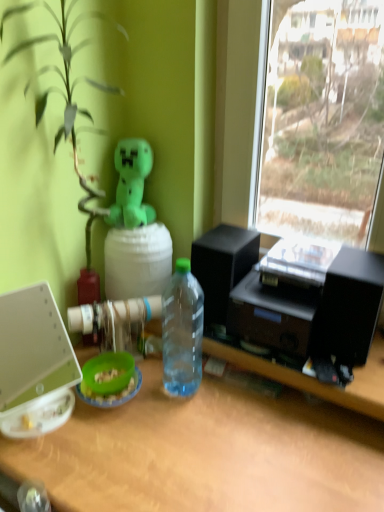
Question: Is transparent plastic bottle at center not near white plastic laptop at left?

Choices:
 (A) yes
 (B) no

Answer: (B)

Question: From a real-world perspective, is transparent plastic bottle at center on white plastic laptop at left?

Choices:
 (A) no
 (B) yes

Answer: (B)

Question: Is transparent plastic bottle at center positioned behind white plastic laptop at left?

Choices:
 (A) no
 (B) yes

Answer: (B)

Question: Is transparent plastic bottle at center at the left side of white plastic laptop at left?

Choices:
 (A) yes
 (B) no

Answer: (B)

Question: Is transparent plastic bottle at center smaller than white plastic laptop at left?

Choices:
 (A) yes
 (B) no

Answer: (A)

Question: Is transparent plastic bottle at center placed right next to white plastic laptop at left?

Choices:
 (A) no
 (B) yes

Answer: (A)

Question: From the image's perspective, is green plush toy at upper center over white plastic laptop at left?

Choices:
 (A) yes
 (B) no

Answer: (A)

Question: Is green plush toy at upper center with white plastic laptop at left?

Choices:
 (A) no
 (B) yes

Answer: (A)

Question: Does green plush toy at upper center have a greater width compared to white plastic laptop at left?

Choices:
 (A) no
 (B) yes

Answer: (A)

Question: From a real-world perspective, is green plush toy at upper center physically above white plastic laptop at left?

Choices:
 (A) no
 (B) yes

Answer: (B)

Question: Does green plush toy at upper center have a greater height compared to white plastic laptop at left?

Choices:
 (A) yes
 (B) no

Answer: (B)

Question: Can you confirm if green plush toy at upper center is thinner than white plastic laptop at left?

Choices:
 (A) no
 (B) yes

Answer: (B)

Question: Can you confirm if white plastic laptop at left is bigger than green plush toy at upper center?

Choices:
 (A) yes
 (B) no

Answer: (A)